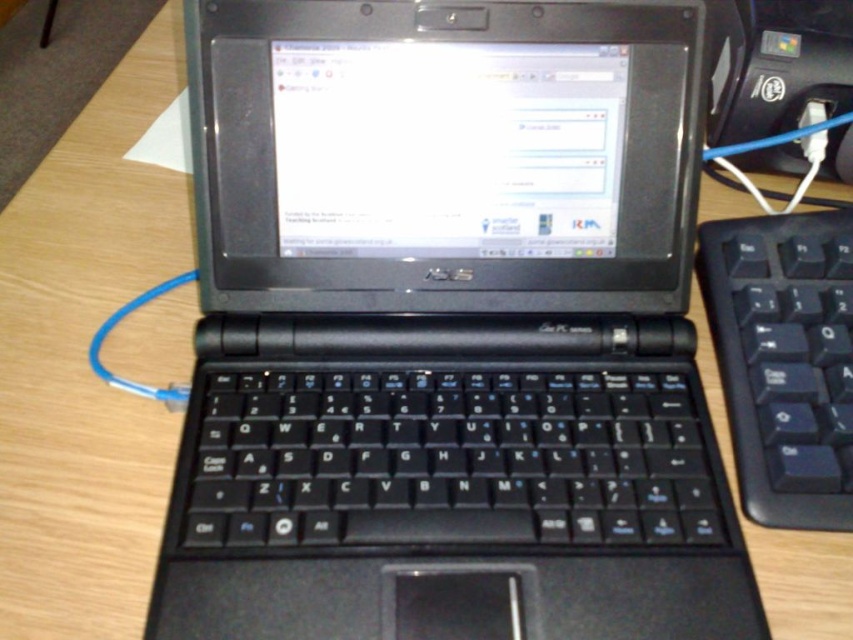
Does point (335, 26) come closer to viewer compared to point (840, 464)?

That is False.

Locate an element on the screen. black plastic laptop at center is located at coordinates (445, 368).

Between black plastic laptop at center and black plastic mouse at center, which one is positioned higher?

black plastic laptop at center is higher up.

Which is in front, point (625, 420) or point (492, 616)?

Point (492, 616) is in front.

Between point (437, 531) and point (456, 616), which one is positioned in front?

Point (456, 616) is more forward.

The width and height of the screenshot is (853, 640). I want to click on black plastic laptop at center, so click(x=445, y=368).

Can you confirm if black plastic keyboard at right is positioned below black plastic mouse at center?

No.

Find the location of a particular element. This screenshot has height=640, width=853. black plastic keyboard at right is located at coordinates (785, 360).